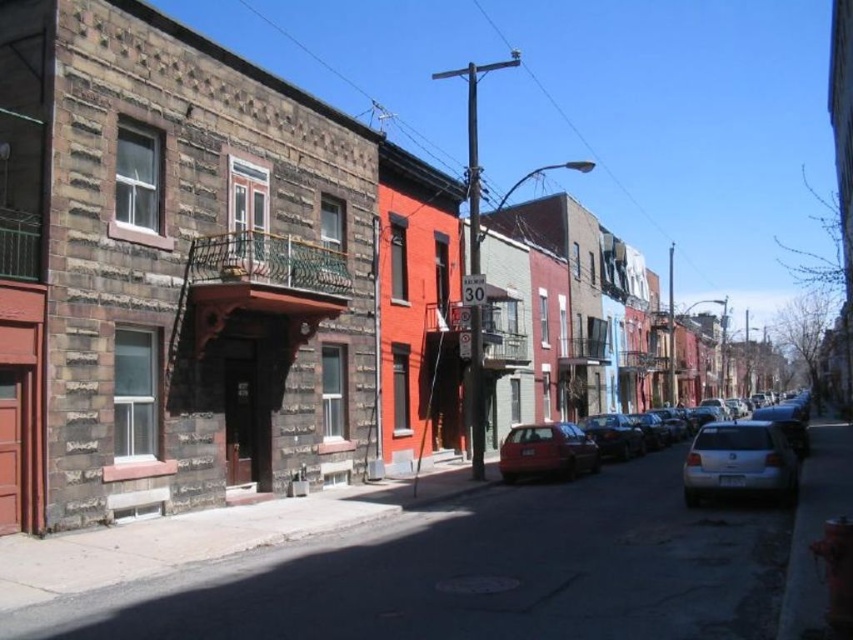
You are a delivery driver who needs to park your matte red car at center in a specific spot. What are the coordinates where you should park?

The coordinates for the matte red car at center are at point [546,451].

Based on the photo, you are a delivery person needing to park your vehicle between the two sedans. The matte silver sedan at center and the silver metallic sedan at lower right are in your way. Which sedan should you move to allow enough space for your delivery van, which is 2 meters tall?

The matte silver sedan at center is taller than the silver metallic sedan at lower right. To allow enough space for your 2 meters tall delivery van, you should move the taller sedan, which is the matte silver sedan at center, to ensure clearance.